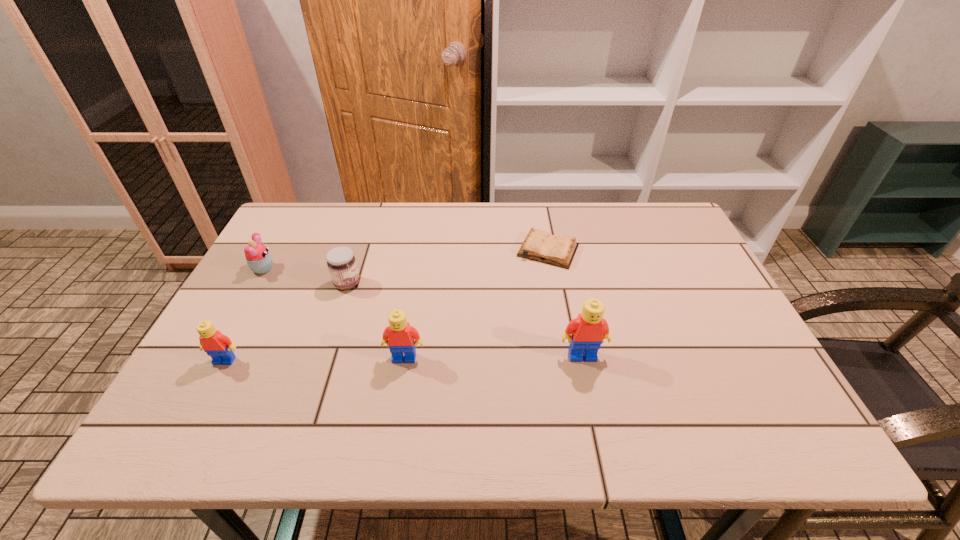
The image size is (960, 540). Find the location of `vacant area at the far left corner of the desktop`. vacant area at the far left corner of the desktop is located at coordinates (279, 220).

Find the location of a particular element. This screenshot has width=960, height=540. vacant region at the near left corner of the desktop is located at coordinates (224, 401).

Identify the location of free point at the far right corner. (671, 241).

I want to click on vacant space in between the rightmost Lego and the diary, so click(565, 303).

Identify the location of free space between the rightmost Lego and the third object from left to right. (465, 320).

Find the location of a particular element. free area in between the rightmost Lego and the cupcake is located at coordinates (422, 312).

Locate an element on the screen. This screenshot has width=960, height=540. vacant space that is in between the third tallest object and the jam is located at coordinates (286, 322).

Where is `free space between the shortest Lego and the fourth object from right to left`? free space between the shortest Lego and the fourth object from right to left is located at coordinates (286, 322).

The height and width of the screenshot is (540, 960). I want to click on free space between the shortest object and the jam, so click(447, 267).

Identify the location of free point between the rightmost Lego and the fourth object from left to right. The height and width of the screenshot is (540, 960). (493, 357).